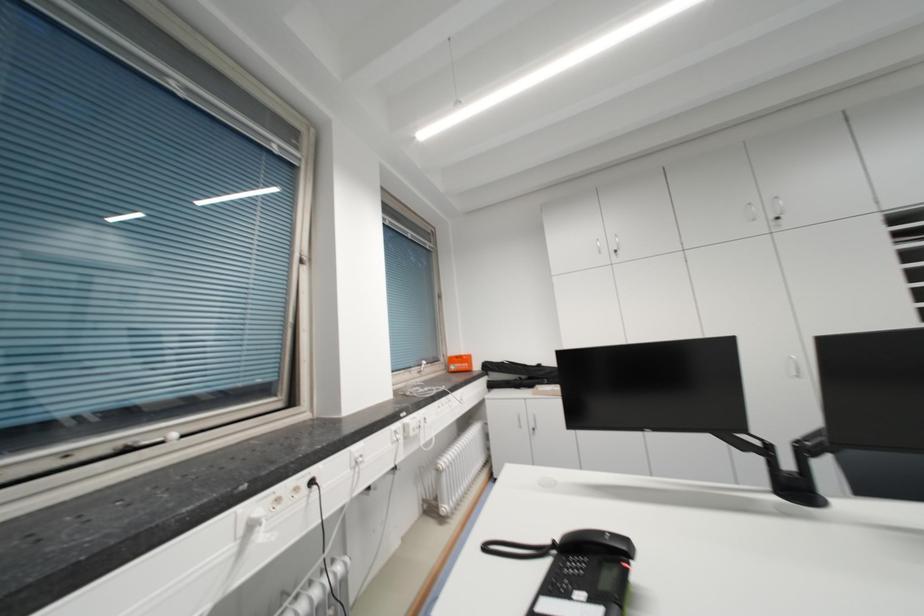
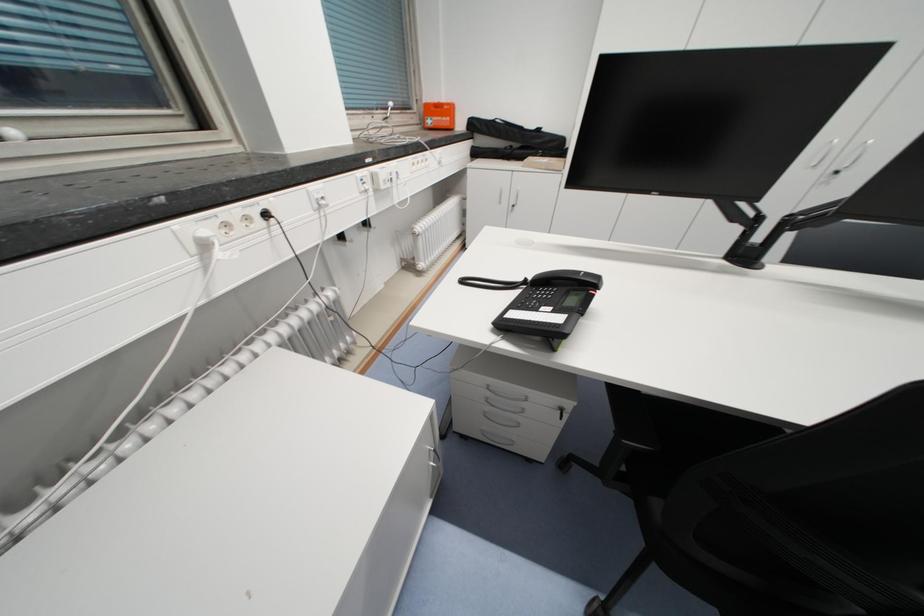
Question: Based on the continuous images, in which direction is the camera rotating? Reply with the corresponding letter.

Choices:
 (A) Left
 (B) Right
 (C) Up
 (D) Down

Answer: (D)